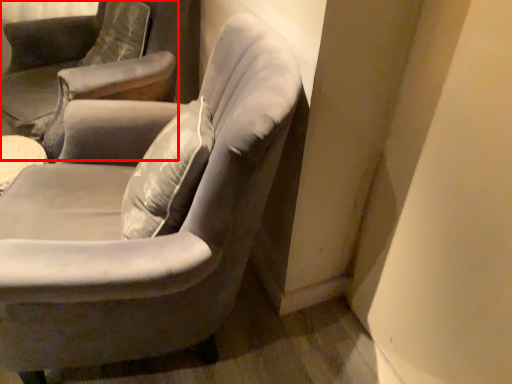
Question: Observing the image, what is the correct spatial positioning of chair (annotated by the red box) in reference to chair?

Choices:
 (A) left
 (B) right

Answer: (A)